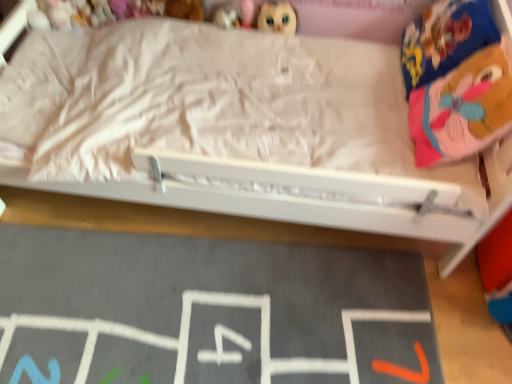
Question: Is soft plush bear at upper center, the third toy when ordered from right to left, facing towards black chalkboard at lower center?

Choices:
 (A) no
 (B) yes

Answer: (A)

Question: Can you confirm if soft plush bear at upper center, the second toy in the left-to-right sequence, is positioned to the left of black chalkboard at lower center?

Choices:
 (A) yes
 (B) no

Answer: (A)

Question: Is soft plush bear at upper center, the second toy in the left-to-right sequence, to the right of black chalkboard at lower center from the viewer's perspective?

Choices:
 (A) yes
 (B) no

Answer: (B)

Question: Is soft plush bear at upper center, the second toy in the left-to-right sequence, not close to black chalkboard at lower center?

Choices:
 (A) yes
 (B) no

Answer: (A)

Question: Does soft plush bear at upper center, the second toy in the left-to-right sequence, lie behind black chalkboard at lower center?

Choices:
 (A) no
 (B) yes

Answer: (B)

Question: Is soft plush bear at upper center, the third toy when ordered from right to left, in front of black chalkboard at lower center?

Choices:
 (A) yes
 (B) no

Answer: (B)

Question: Is pink fabric pillow at upper right bigger than soft plush bear at upper center, the third toy when ordered from right to left?

Choices:
 (A) yes
 (B) no

Answer: (A)

Question: Is pink fabric pillow at upper right outside soft plush bear at upper center, the second toy in the left-to-right sequence?

Choices:
 (A) no
 (B) yes

Answer: (B)

Question: Considering the relative sizes of pink fabric pillow at upper right and soft plush bear at upper center, the third toy when ordered from right to left, in the image provided, is pink fabric pillow at upper right thinner than soft plush bear at upper center, the third toy when ordered from right to left,?

Choices:
 (A) yes
 (B) no

Answer: (B)

Question: Can you confirm if pink fabric pillow at upper right is taller than soft plush bear at upper center, the third toy when ordered from right to left?

Choices:
 (A) no
 (B) yes

Answer: (B)

Question: Can you confirm if pink fabric pillow at upper right is smaller than soft plush bear at upper center, the third toy when ordered from right to left?

Choices:
 (A) yes
 (B) no

Answer: (B)

Question: Is pink fabric pillow at upper right positioned in front of soft plush bear at upper center, the second toy in the left-to-right sequence?

Choices:
 (A) no
 (B) yes

Answer: (B)

Question: Is the surface of matte plastic toy at upper center, the second toy when ordered from right to left, in direct contact with plush toy at upper left, the 1th toy from the left?

Choices:
 (A) yes
 (B) no

Answer: (B)